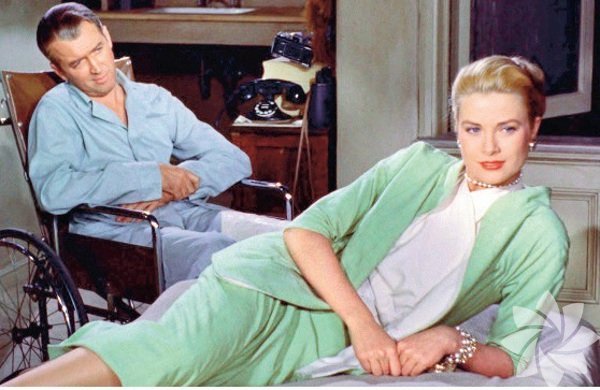
At what (x,y) coordinates should I click in order to perform the action: click on wall. Please return your answer as a coordinate pair (x, y). This screenshot has height=390, width=600. Looking at the image, I should click on (398, 55).